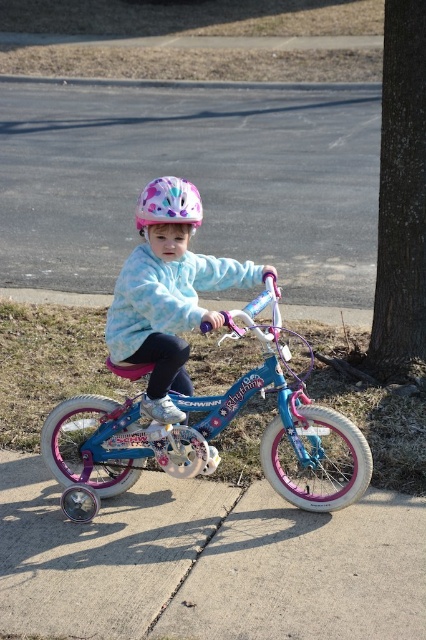
Which is above, smooth concrete pavement at center or shiny blue bicycle at center?

Positioned higher is shiny blue bicycle at center.

Looking at this image, does smooth concrete pavement at center come behind shiny blue bicycle at center?

That is False.

Which is in front, point (371, 636) or point (265, 392)?

Point (371, 636) is in front.

You are a GUI agent. You are given a task and a screenshot of the screen. Output one action in this format:
    pyautogui.click(x=<x>, y=<y>)
    Task: Click on the smooth concrete pavement at center
    
    Given the screenshot: What is the action you would take?
    pyautogui.click(x=207, y=563)

Can you confirm if brown rough bark tree at right is positioned to the right of pastel polka dot helmet at center?

Indeed, brown rough bark tree at right is positioned on the right side of pastel polka dot helmet at center.

Which of these two, brown rough bark tree at right or pastel polka dot helmet at center, stands shorter?

pastel polka dot helmet at center is shorter.

Locate an element on the screen. This screenshot has width=426, height=640. brown rough bark tree at right is located at coordinates (400, 196).

Does point (367, 476) come farther from viewer compared to point (175, 196)?

That is True.

What do you see at coordinates (204, 432) in the screenshot?
I see `shiny blue bicycle at center` at bounding box center [204, 432].

Locate an element on the screen. The image size is (426, 640). shiny blue bicycle at center is located at coordinates (204, 432).